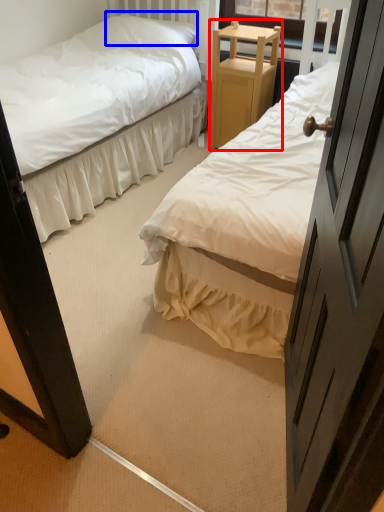
Question: Which object appears farthest to the camera in this image, furniture (highlighted by a red box) or pillow (highlighted by a blue box)?

Choices:
 (A) furniture
 (B) pillow

Answer: (B)